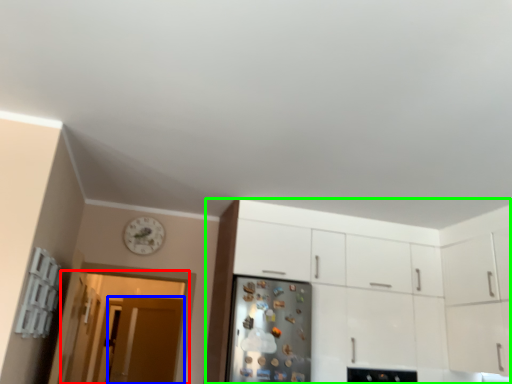
Question: Considering the real-world distances, which object is closest to glass door (highlighted by a red box)? door (highlighted by a blue box) or cabinetry (highlighted by a green box).

Choices:
 (A) door
 (B) cabinetry

Answer: (A)